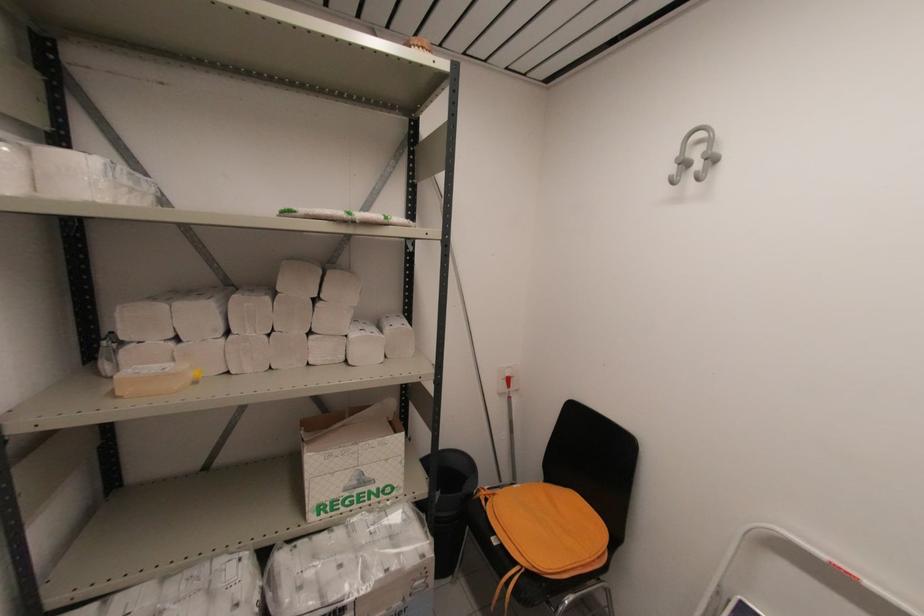
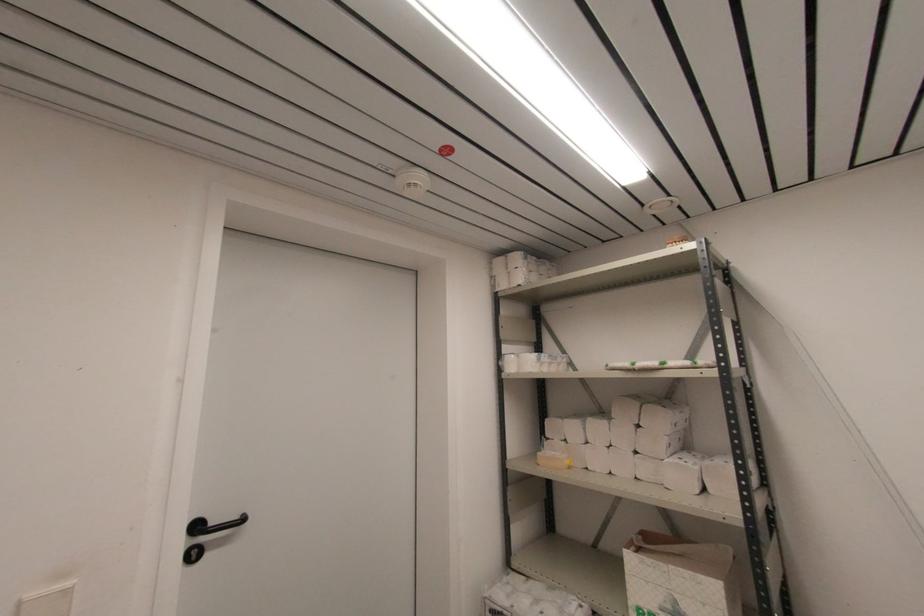
The images are taken continuously from a first-person perspective. In which direction is your viewpoint rotating?

The camera's rotation is toward left-up.